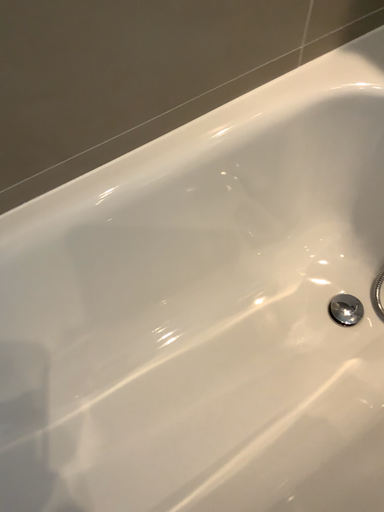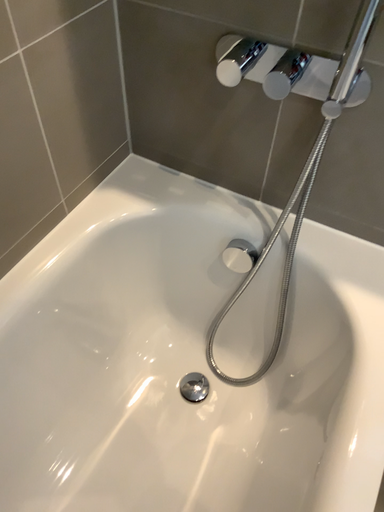
Question: Which way did the camera rotate in the video?

Choices:
 (A) rotated upward
 (B) rotated downward

Answer: (A)